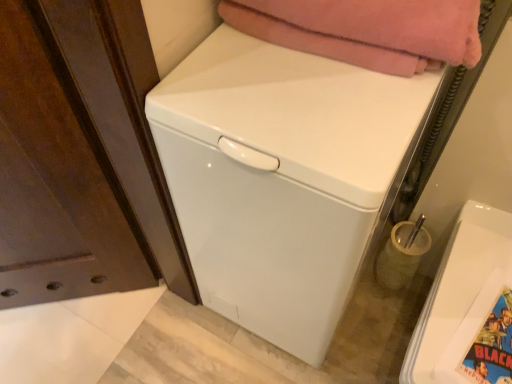
The width and height of the screenshot is (512, 384). I want to click on empty space that is ontop of white glossy washing machine at lower right, which is the first washing machine in right-to-left order (from a real-world perspective), so click(x=482, y=308).